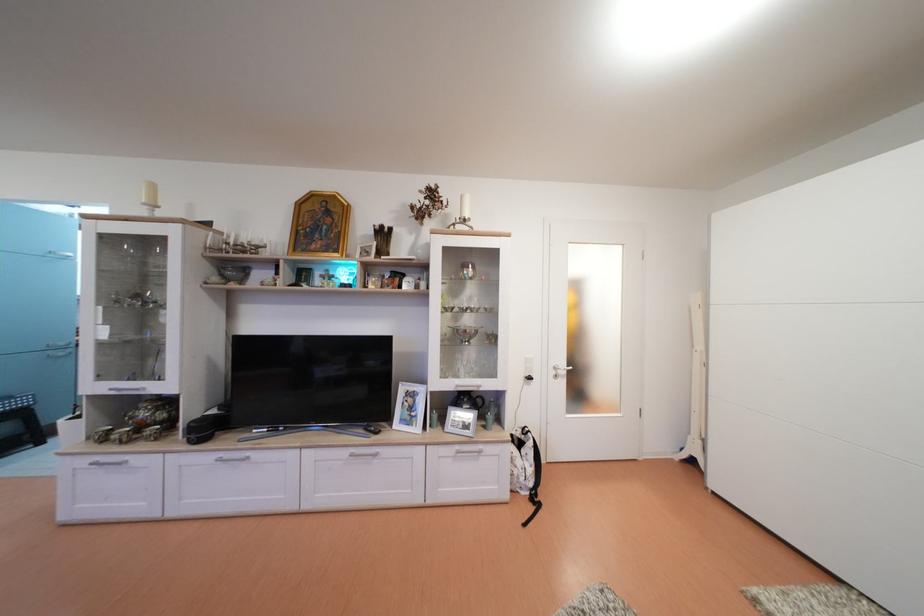
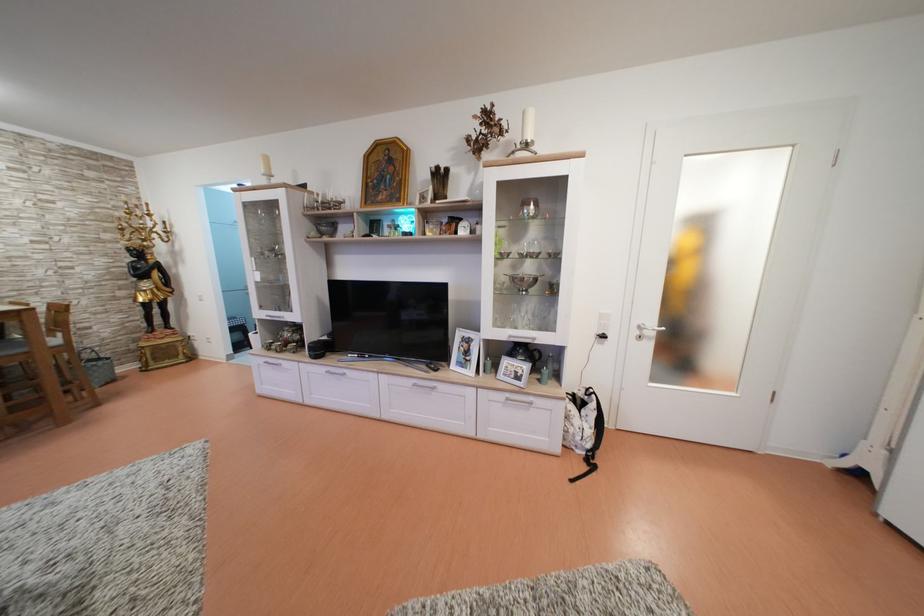
Locate, in the second image, the point that corresponds to pixel 359 456 in the first image.

(422, 387)